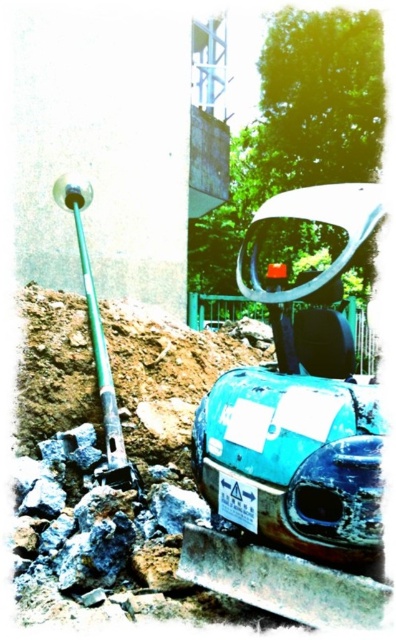
You are a construction worker who needs to place a new tool at the same location as the brown soil at lower left. According to the coordinates provided, where exactly should you place the new tool?

The brown soil at lower left is located at point [163,372], so you should place the new tool at those coordinates.

In the scene shown: You are a construction worker assessing the site. You need to move the teal matte car at center and the brown soil at lower left. Which object requires more space to be relocated?

The brown soil at lower left requires more space to be relocated because it occupies more space than the teal matte car at center.

You are a construction worker standing at the origin point in the image. You need to move the teal matte car at center to a new location. Which direction should you move it to avoid the pile of dirt and debris in the foreground?

The teal matte car at center is located at point (300, 390). To avoid the pile of dirt and debris in the foreground, you should move it in the direction away from the origin point, which would be towards higher coordinate values such as increasing the x or y axis depending on the layout.